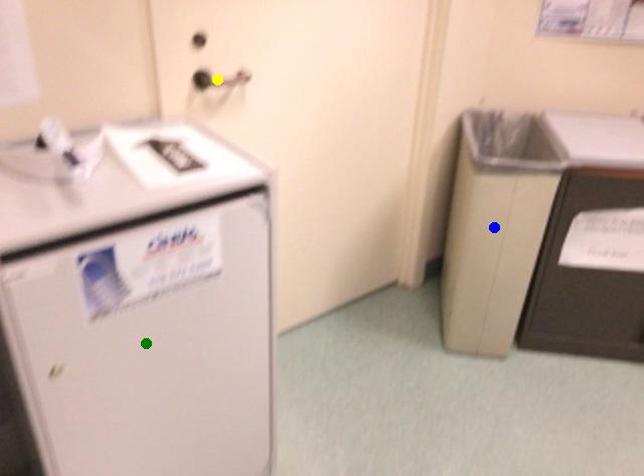
Order these from nearest to farthest:
green point
yellow point
blue point

1. blue point
2. yellow point
3. green point